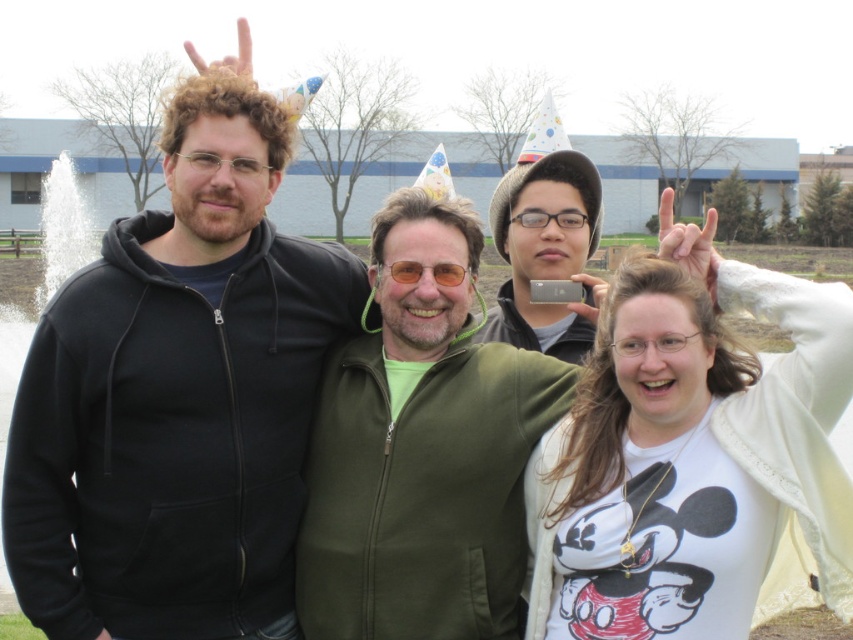
Question: Does green matte jacket at center have a greater width compared to orange reflective glasses at center?

Choices:
 (A) yes
 (B) no

Answer: (A)

Question: Is black fleece jacket at left closer to the viewer compared to white matte t-shirt at center?

Choices:
 (A) no
 (B) yes

Answer: (A)

Question: Which of the following is the farthest from the observer?

Choices:
 (A) black fleece jacket at left
 (B) orange reflective glasses at center
 (C) white matte t-shirt at center
 (D) green matte jacket at center

Answer: (B)

Question: Is black fleece jacket at left further to camera compared to white matte t-shirt at center?

Choices:
 (A) yes
 (B) no

Answer: (A)

Question: Which point is farther to the camera?

Choices:
 (A) (561, 464)
 (B) (399, 336)
 (C) (392, 266)
 (D) (91, 342)

Answer: (C)

Question: Which object appears closest to the camera in this image?

Choices:
 (A) white matte t-shirt at center
 (B) orange reflective glasses at center

Answer: (A)